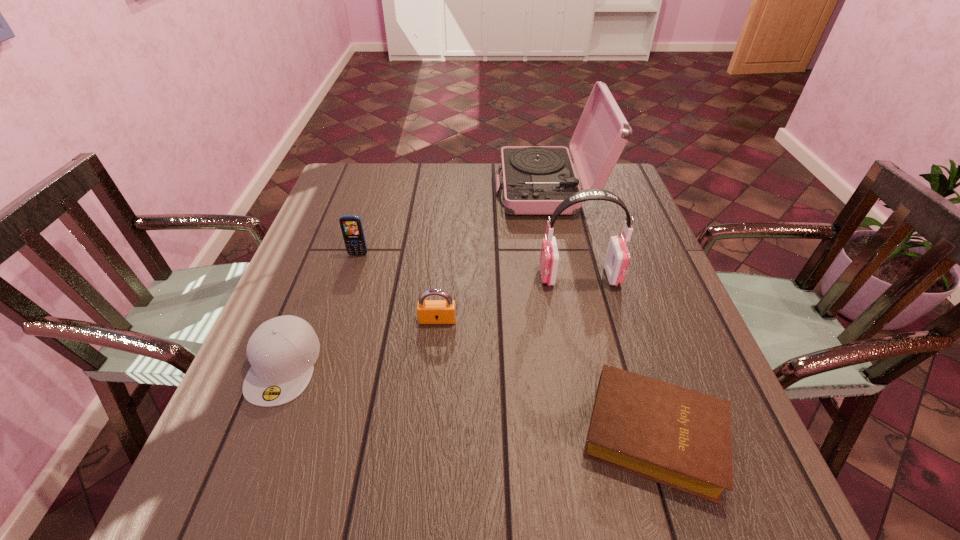
Locate an element on the screen. vacant space located 0.160m with the lid open on the farthest object is located at coordinates (444, 189).

The image size is (960, 540). I want to click on blank space located 0.320m with the lid open on the farthest object, so 393,189.

Find the location of a particular element. vacant space located on the outer surface of the earphone is located at coordinates [x=418, y=276].

Find the location of a particular element. The height and width of the screenshot is (540, 960). free location located 0.320m on the outer surface of the earphone is located at coordinates (409, 276).

In order to click on vacant area situated 0.170m on the outer surface of the earphone in this screenshot , I will do `click(470, 276)`.

Image resolution: width=960 pixels, height=540 pixels. I want to click on free spot located 0.080m on the screen of the cellular telephone, so click(351, 278).

The image size is (960, 540). Find the location of `vacant space located to unlock the padlock from the front`. vacant space located to unlock the padlock from the front is located at coordinates (433, 367).

At what (x,y) coordinates should I click in order to perform the action: click on free space located 0.150m on the front-facing side of the fifth tallest object. Please return your answer as a coordinate pair (x, y). Looking at the image, I should click on (234, 491).

Locate an element on the screen. blank space located 0.250m on the left of the shortest object is located at coordinates (438, 435).

Identify the location of object that is positioned at the far edge. (536, 179).